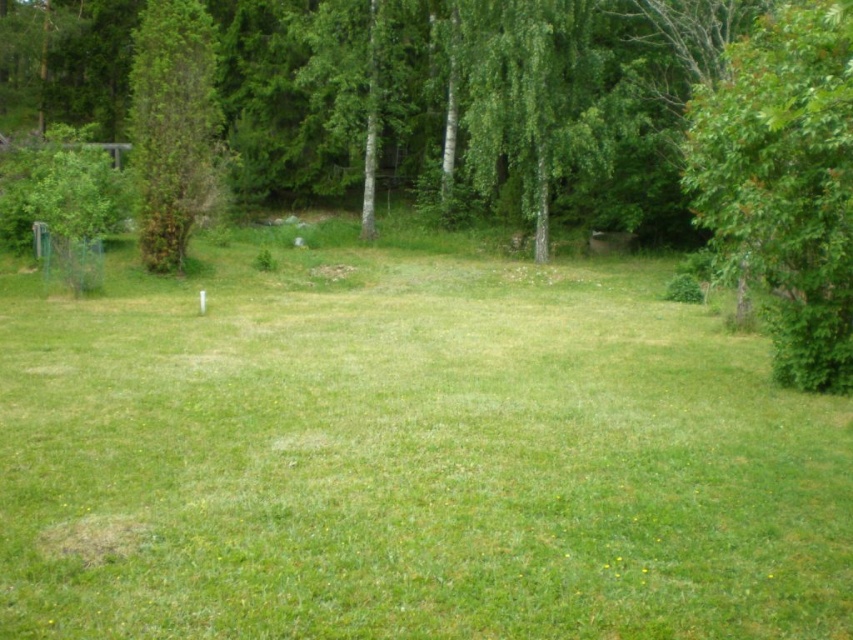
Consider the image. Does green grass at center have a lesser width compared to green leafy tree at left?

No, green grass at center is not thinner than green leafy tree at left.

Which of these two, green grass at center or green leafy tree at left, stands taller?

green leafy tree at left

The height and width of the screenshot is (640, 853). Identify the location of green grass at center. (409, 460).

Based on the photo, who is more forward, (546, 109) or (782, 65)?

Positioned in front is point (782, 65).

Find the location of a particular element. The image size is (853, 640). green leafy tree at center is located at coordinates (537, 132).

Does green leafy tree at right have a lesser width compared to green leafy tree at left?

Yes.

Find the location of `green leafy tree at right`. green leafy tree at right is located at coordinates [x=785, y=180].